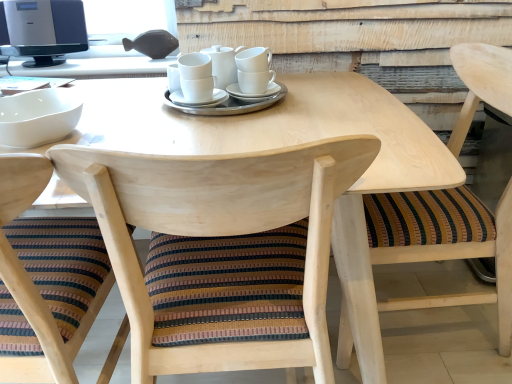
Question: Is white ceramic cups at center wider than white ceramic saucer at center, the 2th saucer positioned from the right?

Choices:
 (A) no
 (B) yes

Answer: (A)

Question: From the image's perspective, does white ceramic cups at center appear lower than white ceramic saucer at center, the 2th saucer positioned from the right?

Choices:
 (A) no
 (B) yes

Answer: (A)

Question: Considering the relative sizes of white ceramic cups at center and white ceramic saucer at center, the 1th saucer viewed from the left, in the image provided, is white ceramic cups at center thinner than white ceramic saucer at center, the 1th saucer viewed from the left,?

Choices:
 (A) yes
 (B) no

Answer: (A)

Question: Does white ceramic cups at center come behind white ceramic saucer at center, the 1th saucer viewed from the left?

Choices:
 (A) no
 (B) yes

Answer: (B)

Question: Can you confirm if white ceramic cups at center is taller than white ceramic saucer at center, the 2th saucer positioned from the right?

Choices:
 (A) yes
 (B) no

Answer: (A)

Question: From a real-world perspective, is satin black monitor at upper left physically located above or below white ceramic cups at center?

Choices:
 (A) above
 (B) below

Answer: (A)

Question: Would you say satin black monitor at upper left is to the left or to the right of white ceramic cups at center in the picture?

Choices:
 (A) right
 (B) left

Answer: (B)

Question: Looking at their shapes, would you say satin black monitor at upper left is wider or thinner than white ceramic cups at center?

Choices:
 (A) thin
 (B) wide

Answer: (B)

Question: Choose the correct answer: Is satin black monitor at upper left inside white ceramic cups at center or outside it?

Choices:
 (A) inside
 (B) outside

Answer: (B)

Question: Does point (314, 340) appear closer or farther from the camera than point (219, 76)?

Choices:
 (A) closer
 (B) farther

Answer: (A)

Question: Relative to white ceramic cups at center, is natural wood chair at center, the 2th chair when ordered from left to right, in front or behind?

Choices:
 (A) behind
 (B) front

Answer: (B)

Question: Considering the positions of natural wood chair at center, the 2th chair when ordered from left to right, and white ceramic cups at center in the image, is natural wood chair at center, the 2th chair when ordered from left to right, taller or shorter than white ceramic cups at center?

Choices:
 (A) tall
 (B) short

Answer: (A)

Question: Is natural wood chair at center, the 2th chair when ordered from left to right, wider or thinner than white ceramic cups at center?

Choices:
 (A) wide
 (B) thin

Answer: (A)

Question: Relative to wooden chair with striped cushion at lower left, the 3th chair positioned from the right, is white ceramic cups at center in front or behind?

Choices:
 (A) front
 (B) behind

Answer: (B)

Question: Based on their sizes in the image, would you say white ceramic cups at center is bigger or smaller than wooden chair with striped cushion at lower left, marked as the 1th chair in a left-to-right arrangement?

Choices:
 (A) small
 (B) big

Answer: (A)